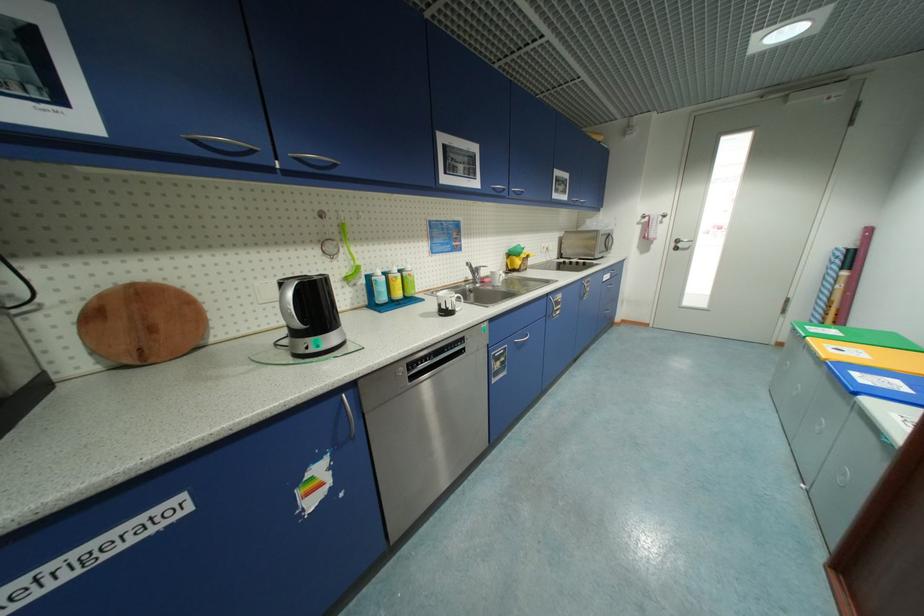
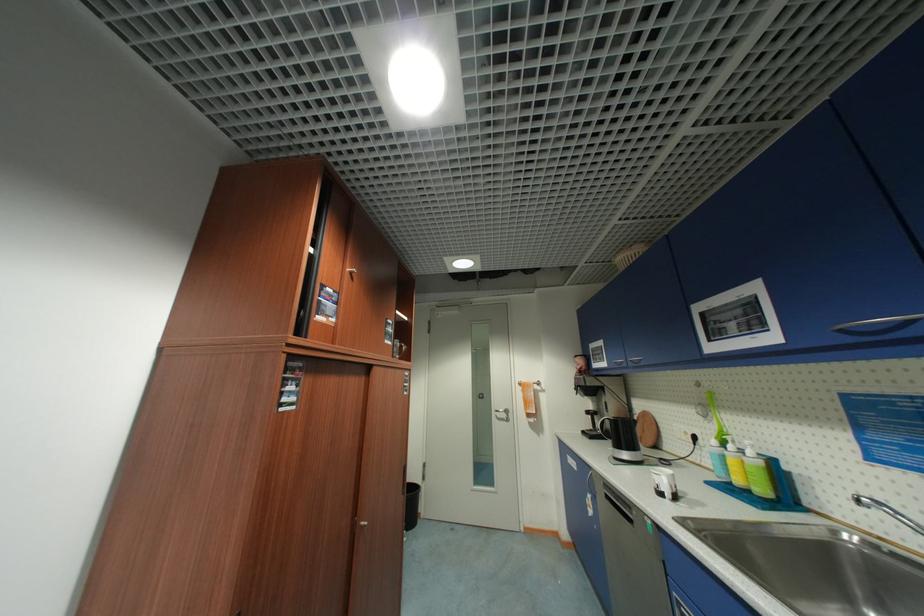
Where in the second image is the point corresponding to point (415, 269) from the first image?

(756, 454)